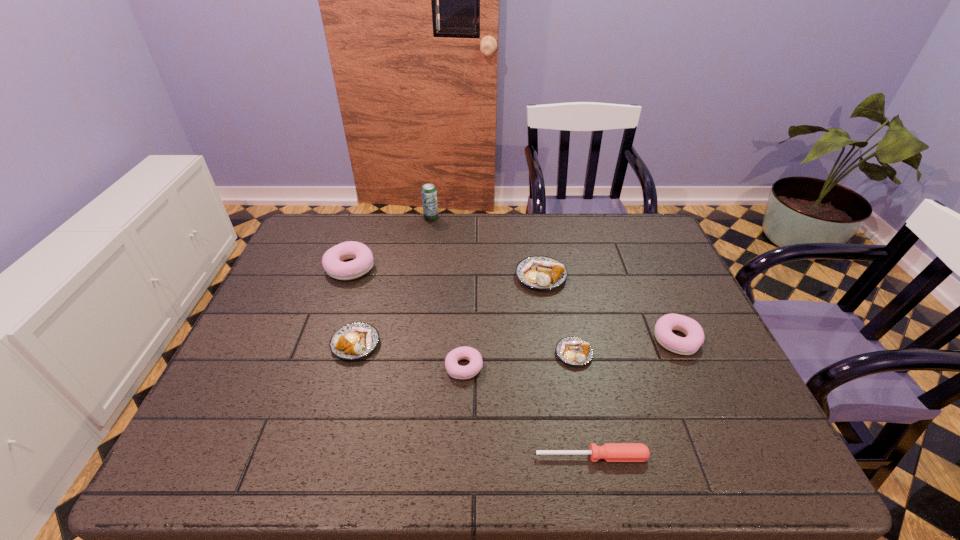
Locate an element on the screen. This screenshot has width=960, height=540. vacant space located 0.350m on the back of the nearest object is located at coordinates 565,322.

Locate an element on the screen. beer can that is at the far edge is located at coordinates (429, 194).

Identify the location of pastry located in the far edge section of the desktop. (332, 260).

Find the location of a particular element. The height and width of the screenshot is (540, 960). object located at the near edge is located at coordinates tap(611, 452).

Identify the location of object positioned at the left edge. Image resolution: width=960 pixels, height=540 pixels. (332, 260).

Locate an element on the screen. Image resolution: width=960 pixels, height=540 pixels. object located at the right edge is located at coordinates (688, 345).

Where is `object that is at the far left corner`? Image resolution: width=960 pixels, height=540 pixels. object that is at the far left corner is located at coordinates (332, 260).

You are a GUI agent. You are given a task and a screenshot of the screen. Output one action in this format:
    pyautogui.click(x=<x>, y=<y>)
    Task: Click on the vacant region at the far edge of the desktop
    Image resolution: width=960 pixels, height=540 pixels.
    Given the screenshot: What is the action you would take?
    pyautogui.click(x=403, y=220)

The width and height of the screenshot is (960, 540). I want to click on blank space at the near edge of the desktop, so click(x=547, y=460).

The width and height of the screenshot is (960, 540). In the image, there is a desktop. In order to click on vacant space at the left edge in this screenshot , I will do `click(276, 310)`.